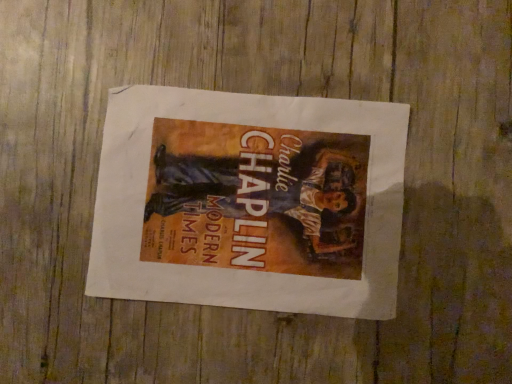
Identify the location of blank space situated above matte paper poster at center (from a real-world perspective). The height and width of the screenshot is (384, 512). (241, 196).